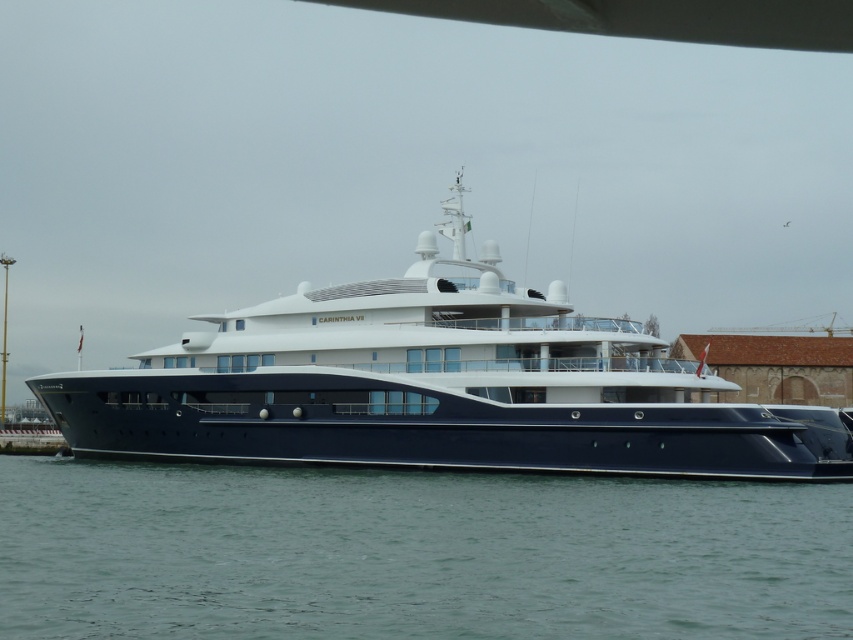
Is green water at lower center to the right of shiny blue yacht at center from the viewer's perspective?

Indeed, green water at lower center is positioned on the right side of shiny blue yacht at center.

Can you confirm if green water at lower center is shorter than shiny blue yacht at center?

Indeed, green water at lower center has a lesser height compared to shiny blue yacht at center.

Between point (740, 515) and point (618, 404), which one is positioned in front?

Point (740, 515) is in front.

Find the location of a particular element. green water at lower center is located at coordinates (413, 554).